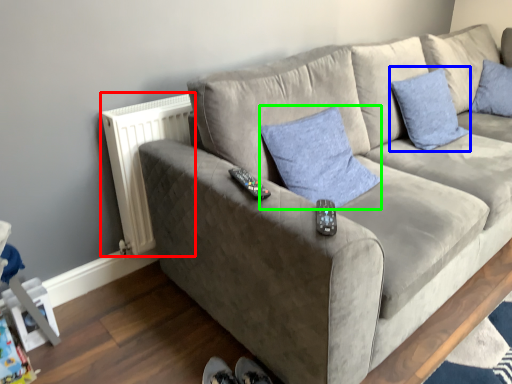
Question: Which object is the closest to the radiator (highlighted by a red box)? Choose among these: pillow (highlighted by a blue box) or pillow (highlighted by a green box).

Choices:
 (A) pillow
 (B) pillow

Answer: (B)